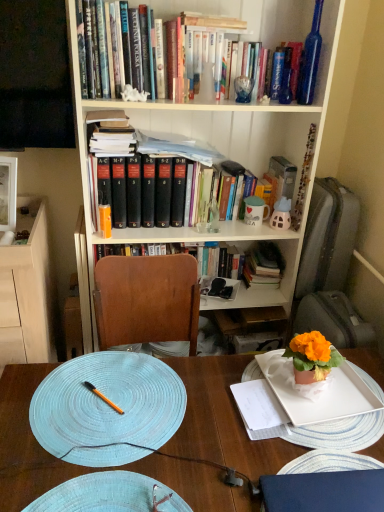
What are the coordinates of `free point behind orange glossy pen at center` in the screenshot? It's located at (118, 373).